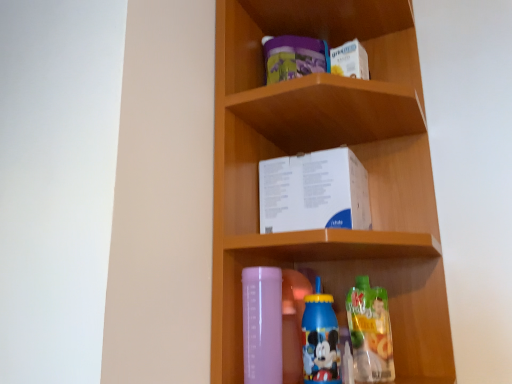
Question: Based on their sizes in the image, would you say matte plastic box at center is bigger or smaller than transparent plastic bottle at lower center, which is the 1th bottle from left to right?

Choices:
 (A) big
 (B) small

Answer: (A)

Question: In terms of height, does matte plastic box at center look taller or shorter compared to transparent plastic bottle at lower center, which is the 1th bottle from left to right?

Choices:
 (A) tall
 (B) short

Answer: (A)

Question: Which object is the farthest from the blue plastic bottle at lower center, the second bottle in the right-to-left sequence?

Choices:
 (A) transparent plastic bottle at lower center, which is the 1th bottle from left to right
 (B) white paper box at center
 (C) translucent plastic juice at lower right, which is the 1th bottle from right to left
 (D) matte plastic box at center

Answer: (D)

Question: Which object is the closest to the transparent plastic bottle at lower center, which is the 1th bottle from left to right?

Choices:
 (A) white paper box at center
 (B) matte plastic box at center
 (C) translucent plastic juice at lower right, which is the 1th bottle from right to left
 (D) blue plastic bottle at lower center, which appears as the second bottle when viewed from the left

Answer: (D)